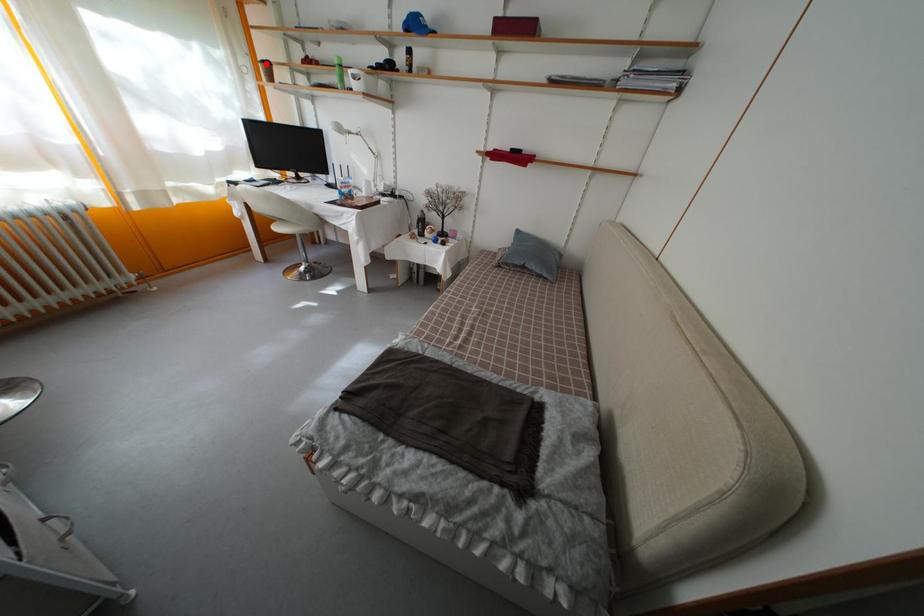
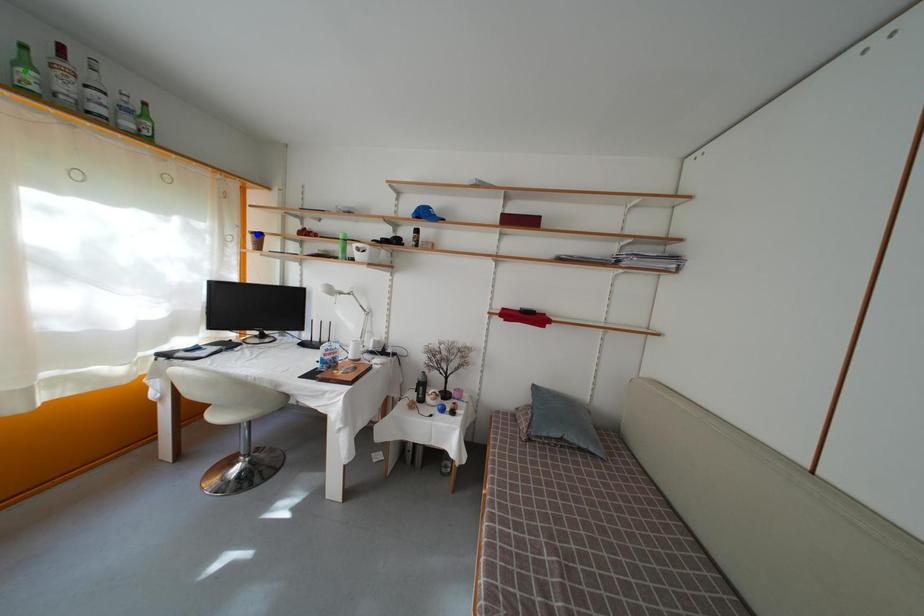
Question: I am providing you with two images of the same scene from different viewpoints. A red point is marked on the first image. You are given multiple points on the second image. Which point in image 2 represents the same 3d spot as the red point in image 1?

Choices:
 (A) blue point
 (B) yellow point
 (C) green point

Answer: (A)